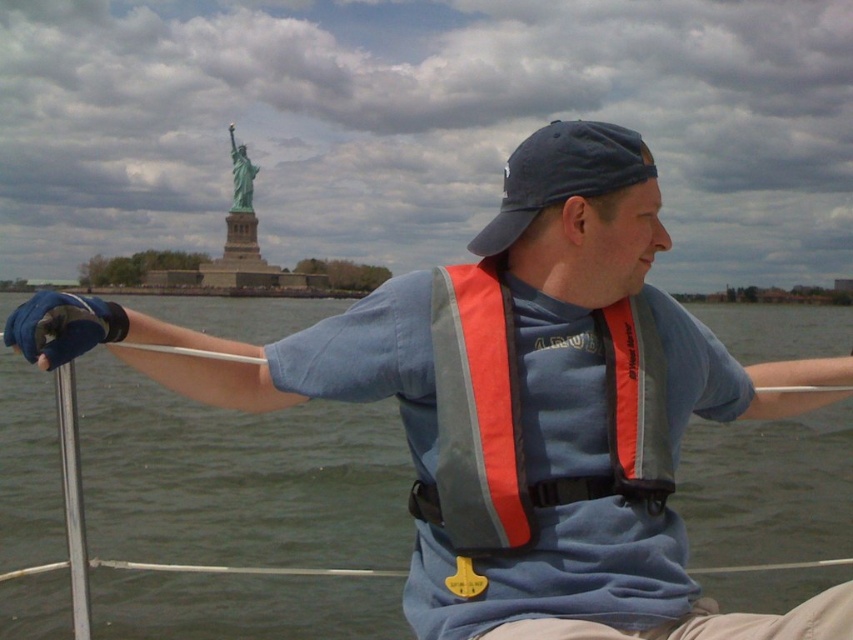
Question: Which point is closer to the camera?

Choices:
 (A) (239, 177)
 (B) (519, 221)

Answer: (B)

Question: Which of the following is the farthest from the observer?

Choices:
 (A) blue fabric baseball cap at center
 (B) green patina statue at upper center

Answer: (B)

Question: Which point is closer to the camera?

Choices:
 (A) (628, 168)
 (B) (238, 202)

Answer: (A)

Question: Is blue fabric baseball cap at center to the right of green patina statue at upper center from the viewer's perspective?

Choices:
 (A) no
 (B) yes

Answer: (B)

Question: In this image, where is blue fabric baseball cap at center located relative to green patina statue at upper center?

Choices:
 (A) right
 (B) left

Answer: (A)

Question: Does blue fabric baseball cap at center have a greater width compared to green patina statue at upper center?

Choices:
 (A) yes
 (B) no

Answer: (A)